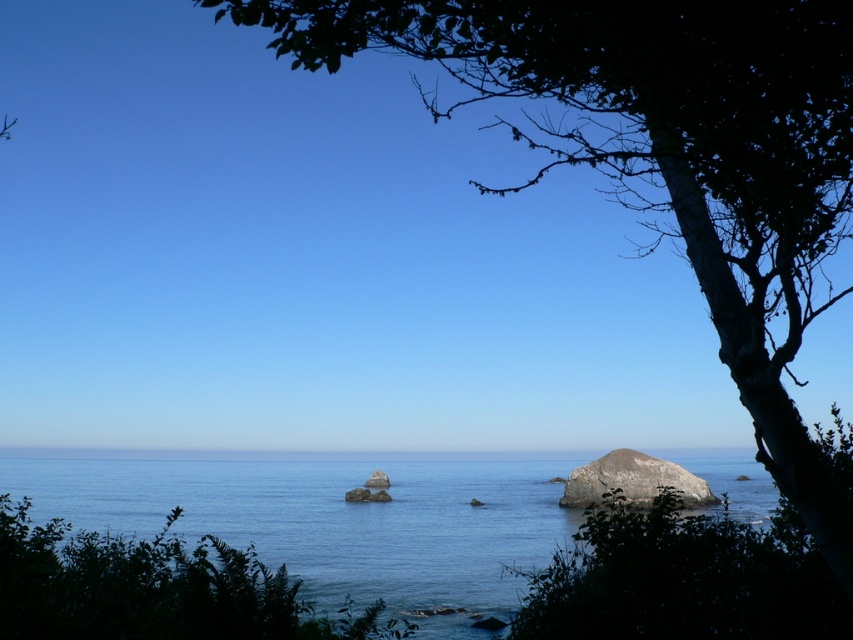
Question: Can you confirm if green leafy tree at upper right is positioned below blue water at center?

Choices:
 (A) no
 (B) yes

Answer: (A)

Question: Is blue water at center positioned at the back of smooth gray rock at center?

Choices:
 (A) no
 (B) yes

Answer: (A)

Question: Estimate the real-world distances between objects in this image. Which object is closer to the green leafy tree at upper right?

Choices:
 (A) green leafy tree at lower left
 (B) smooth gray rock at center
 (C) blue water at center

Answer: (C)

Question: Can you confirm if green leafy tree at lower left is bigger than smooth gray rock at center?

Choices:
 (A) yes
 (B) no

Answer: (A)

Question: Which point appears closest to the camera in this image?

Choices:
 (A) (579, 500)
 (B) (332, 29)
 (C) (59, 547)
 (D) (9, 490)

Answer: (B)

Question: Which is farther from the green leafy tree at lower left?

Choices:
 (A) smooth gray rock at center
 (B) blue water at center
 (C) green leafy tree at upper right

Answer: (A)